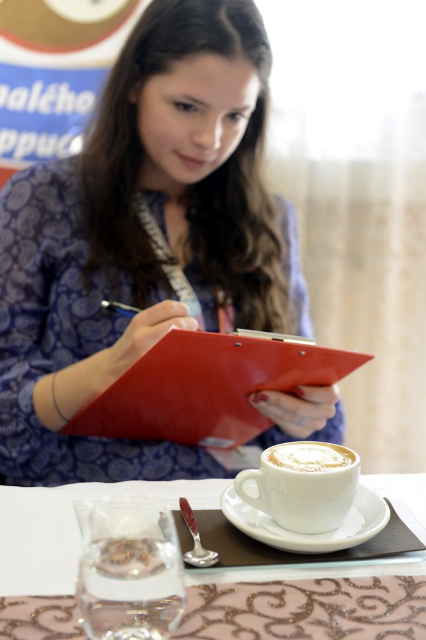
Who is lower down, red matte clipboard at center or white ceramic cup at lower center?

Positioned lower is white ceramic cup at lower center.

Is red matte clipboard at center positioned in front of white ceramic cup at lower center?

No, red matte clipboard at center is behind white ceramic cup at lower center.

Measure the distance between red matte clipboard at center and camera.

They are 33.08 inches apart.

Where is `red matte clipboard at center`? red matte clipboard at center is located at coordinates (207, 387).

Who is shorter, white ceramic cup at lower center or white frothy foam at lower center?

white frothy foam at lower center

Can you confirm if white ceramic cup at lower center is positioned to the left of white frothy foam at lower center?

Indeed, white ceramic cup at lower center is positioned on the left side of white frothy foam at lower center.

This screenshot has height=640, width=426. I want to click on white ceramic cup at lower center, so click(x=304, y=484).

Does red matte clipboard at center appear on the left side of white ceramic saucer at lower center?

Correct, you'll find red matte clipboard at center to the left of white ceramic saucer at lower center.

This screenshot has height=640, width=426. What do you see at coordinates (207, 387) in the screenshot? I see `red matte clipboard at center` at bounding box center [207, 387].

This screenshot has width=426, height=640. What are the coordinates of `red matte clipboard at center` in the screenshot? It's located at (207, 387).